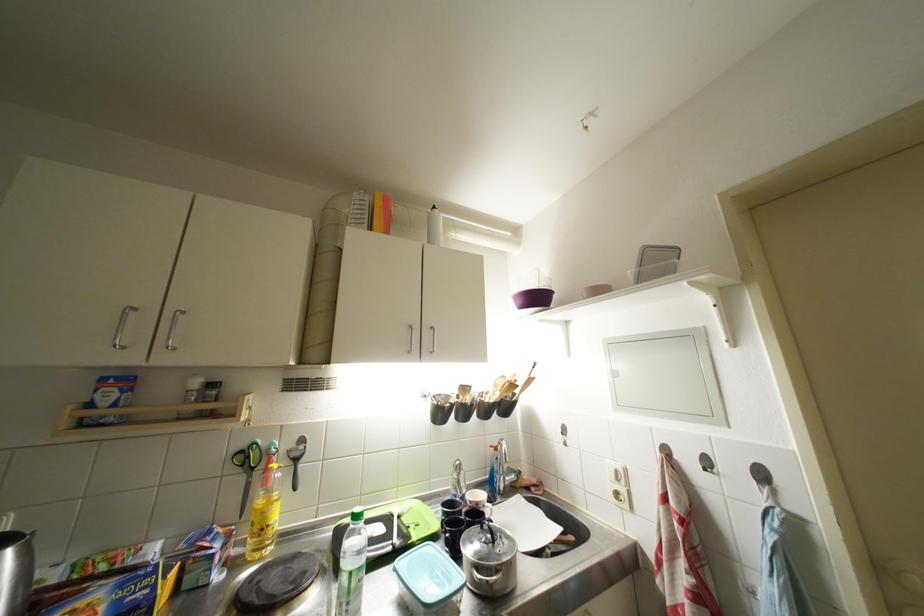
Which object does [264,513] point to?

This point indicates the yellow oil bottle.